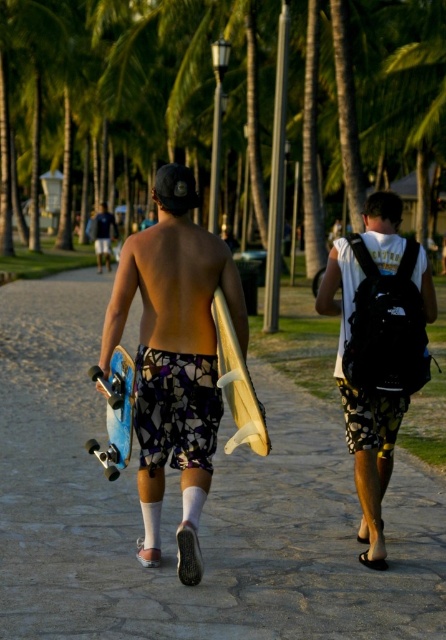
Question: Does matte surfboard at center appear on the left side of blue matte surfboard at center?

Choices:
 (A) no
 (B) yes

Answer: (A)

Question: Can you confirm if light brown wooden surfboard at center is smaller than dark blue t-shirt at upper left?

Choices:
 (A) no
 (B) yes

Answer: (B)

Question: Which point is closer to the camera taking this photo?

Choices:
 (A) (408, 356)
 (B) (94, 218)
 (C) (246, 563)
 (D) (198, 440)

Answer: (D)

Question: Which is farther from the dark blue t-shirt at upper left?

Choices:
 (A) light brown wooden surfboard at center
 (B) blue matte surfboard at center
 (C) printed fabric shorts at center
 (D) black matte backpack at center

Answer: (B)

Question: Which object is positioned closest to the dark blue t-shirt at upper left?

Choices:
 (A) matte surfboard at center
 (B) black matte backpack at center
 (C) light brown wooden surfboard at center

Answer: (A)

Question: Is black matte backpack at center wider than light brown wooden surfboard at center?

Choices:
 (A) no
 (B) yes

Answer: (B)